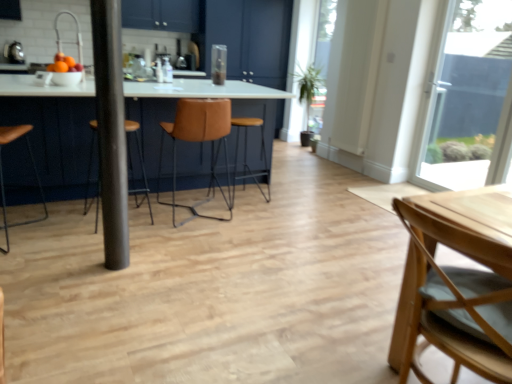
Where is `free space in front of metallic pole at center`? Image resolution: width=512 pixels, height=384 pixels. free space in front of metallic pole at center is located at coordinates (108, 276).